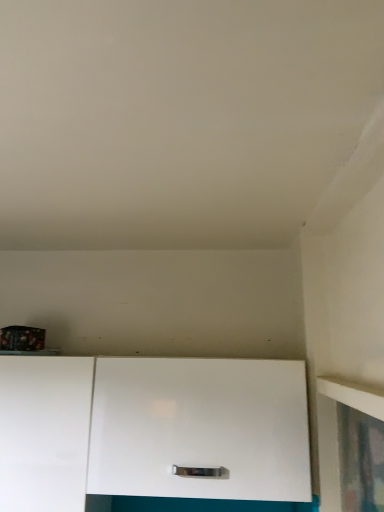
Question: Relative to white glossy cabinet at lower left, arranged as the first cabinetry when viewed from the left, is white glossy cabinet at center, placed as the 1th cabinetry when sorted from right to left, in front or behind?

Choices:
 (A) front
 (B) behind

Answer: (A)

Question: From a real-world perspective, is white glossy cabinet at center, the 2th cabinetry from the left, physically located above or below white glossy cabinet at lower left, arranged as the first cabinetry when viewed from the left?

Choices:
 (A) below
 (B) above

Answer: (B)

Question: Considering the positions of white glossy cabinet at center, the 2th cabinetry from the left, and white glossy cabinet at lower left, the second cabinetry from the right, in the image, is white glossy cabinet at center, the 2th cabinetry from the left, wider or thinner than white glossy cabinet at lower left, the second cabinetry from the right,?

Choices:
 (A) wide
 (B) thin

Answer: (A)

Question: Considering the positions of white glossy cabinet at lower left, arranged as the first cabinetry when viewed from the left, and white glossy cabinet at center, the 2th cabinetry from the left, in the image, is white glossy cabinet at lower left, arranged as the first cabinetry when viewed from the left, bigger or smaller than white glossy cabinet at center, the 2th cabinetry from the left,?

Choices:
 (A) small
 (B) big

Answer: (B)

Question: Considering the positions of white glossy cabinet at lower left, arranged as the first cabinetry when viewed from the left, and white glossy cabinet at center, placed as the 1th cabinetry when sorted from right to left, in the image, is white glossy cabinet at lower left, arranged as the first cabinetry when viewed from the left, taller or shorter than white glossy cabinet at center, placed as the 1th cabinetry when sorted from right to left,?

Choices:
 (A) tall
 (B) short

Answer: (A)

Question: Is white glossy cabinet at lower left, the second cabinetry from the right, spatially inside white glossy cabinet at center, placed as the 1th cabinetry when sorted from right to left, or outside of it?

Choices:
 (A) outside
 (B) inside

Answer: (A)

Question: From the image's perspective, is white glossy cabinet at lower left, the second cabinetry from the right, above or below white glossy cabinet at center, the 2th cabinetry from the left?

Choices:
 (A) above
 (B) below

Answer: (B)